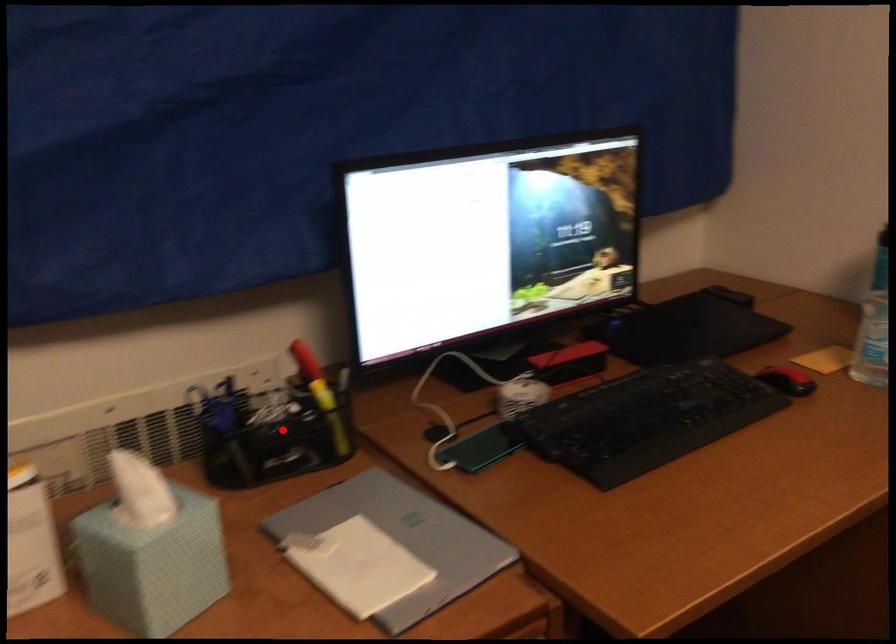
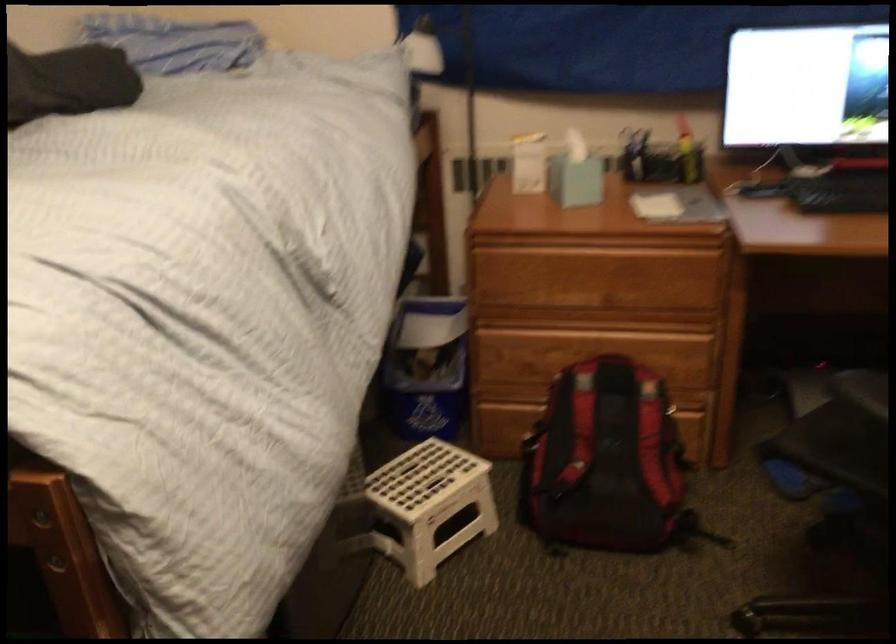
Locate, in the second image, the point that corresponds to the highlighted location in the first image.

(660, 158)